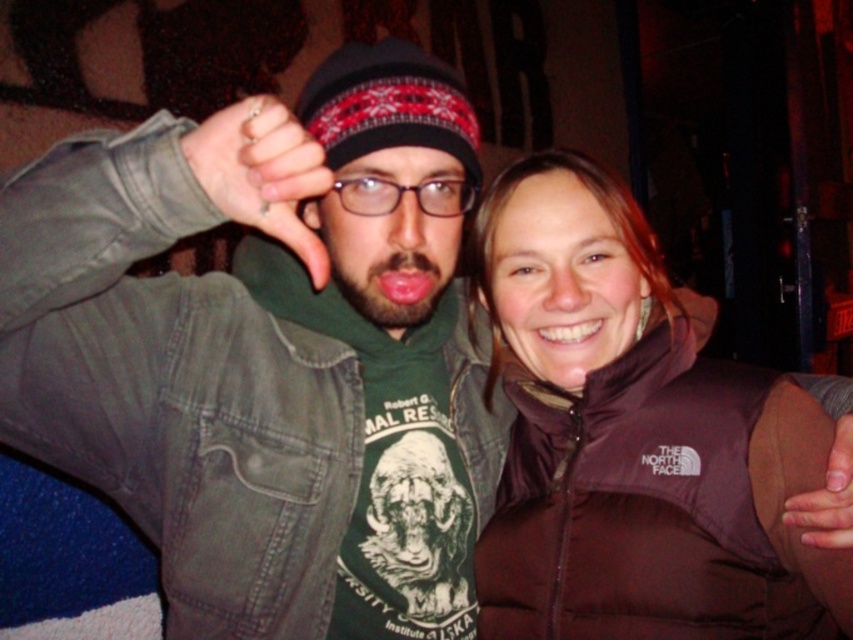
Looking at this image, you are a photographer trying to adjust the focus of your camera. You notice two objects in the frame that are important for the shot. The matte black thumb at center and the brown leather hand at lower right. Which object should you focus on first to ensure it appears sharp in the photo?

The matte black thumb at center should be focused on first since it is closer to the viewer than the brown leather hand at lower right, so focusing on it first will ensure it appears sharp.

You are organizing a coat rack for a winter event and have limited space. You need to hang both the brown down jacket at center and the sweater knit beanie at center. Given their sizes, which item should you hang first to ensure both fit on the rack?

The brown down jacket at center is larger in size than the sweater knit beanie at center, so you should hang the brown down jacket at center first to accommodate its larger size before placing the smaller sweater knit beanie at center.

You are a photographer trying to capture a candid shot of the two people in the scene. You want to ensure that both the sweater knit beanie at center and the brown leather hand at lower right are in focus simultaneously. Given that your camera has a depth of field that can cover 22 inches, will you be able to achieve this?

The distance between the sweater knit beanie at center and the brown leather hand at lower right is 21.96 inches, which is within the camera depth of field of 22 inches. Therefore, you can achieve sharp focus on both objects.